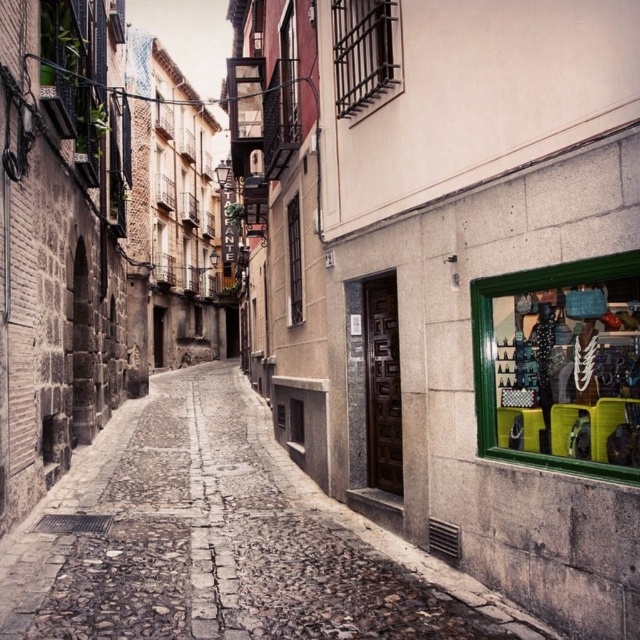
Looking at this image, can you confirm if cobblestone at center is positioned to the right of green plastic baskets at right?

In fact, cobblestone at center is to the left of green plastic baskets at right.

Is cobblestone at center positioned in front of green plastic baskets at right?

No, cobblestone at center is behind green plastic baskets at right.

Does point (120, 449) lie in front of point (550, 266)?

No, (120, 449) is further to viewer.

Locate an element on the screen. The image size is (640, 640). cobblestone at center is located at coordinates (221, 540).